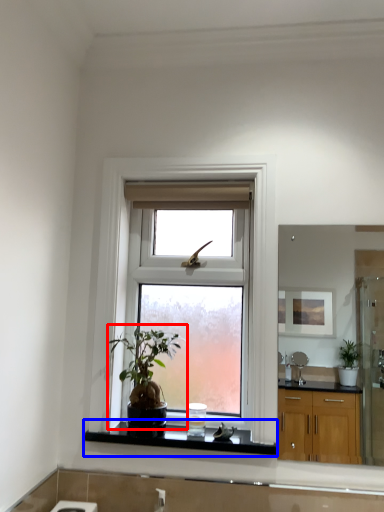
Question: Which object appears closest to the camera in this image, houseplant (highlighted by a red box) or window sill (highlighted by a blue box)?

Choices:
 (A) houseplant
 (B) window sill

Answer: (A)